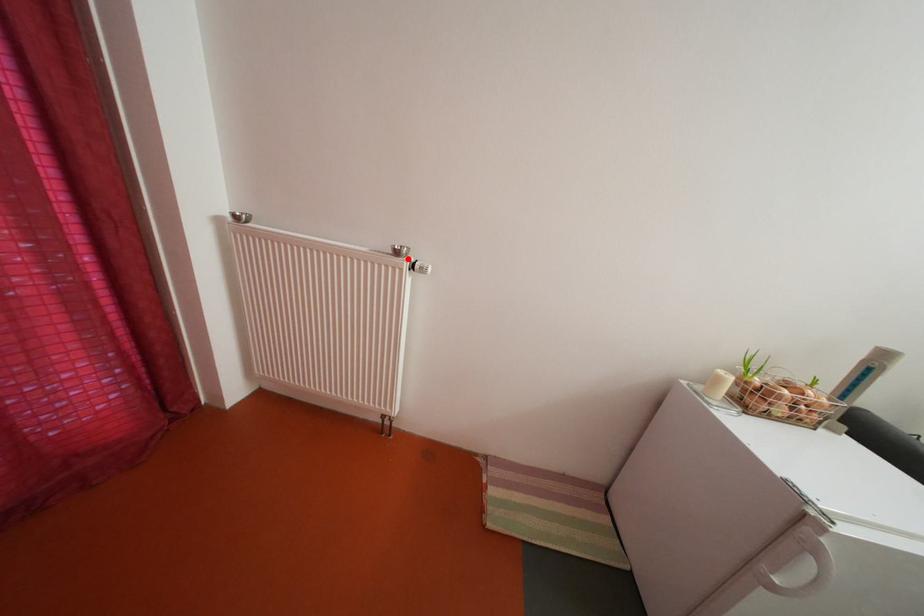
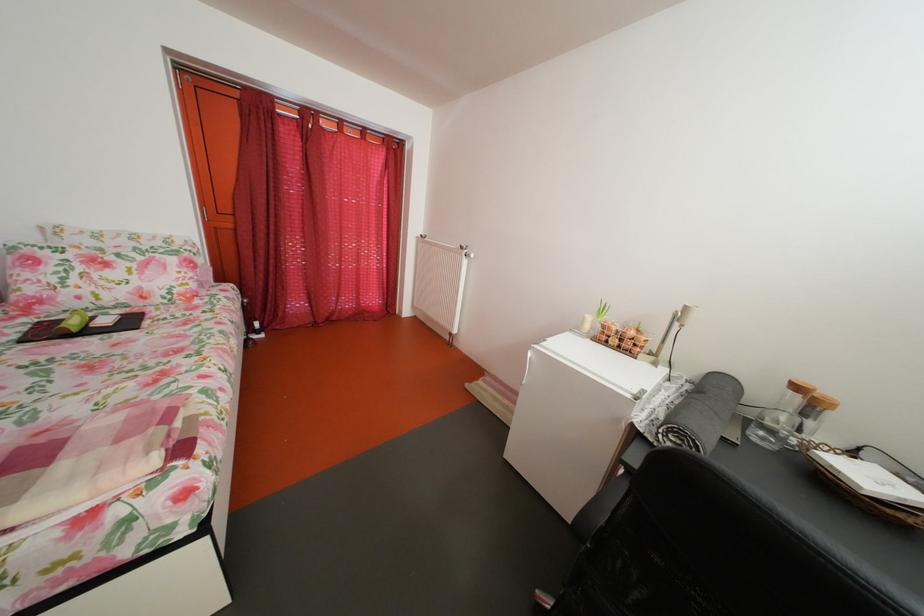
In the second image, find the point that corresponds to the highlighted location in the first image.

(473, 254)